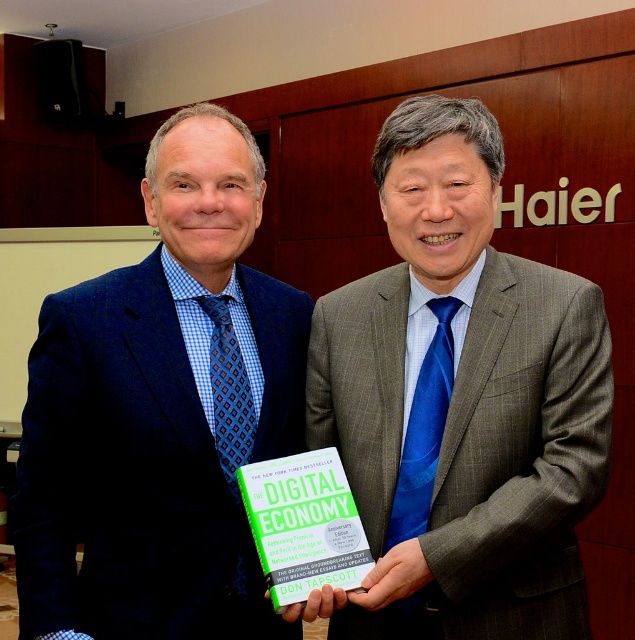
Question: Which object is closer to the camera taking this photo?

Choices:
 (A) blue checkered fabric suit at left
 (B) blue silk tie at center

Answer: (B)

Question: Does blue silk tie at center have a larger size compared to blue checkered fabric suit at left?

Choices:
 (A) no
 (B) yes

Answer: (A)

Question: Does blue silk tie at center lie behind blue checkered fabric suit at left?

Choices:
 (A) no
 (B) yes

Answer: (A)

Question: Is blue silk tie at center positioned behind blue checkered fabric suit at left?

Choices:
 (A) no
 (B) yes

Answer: (A)